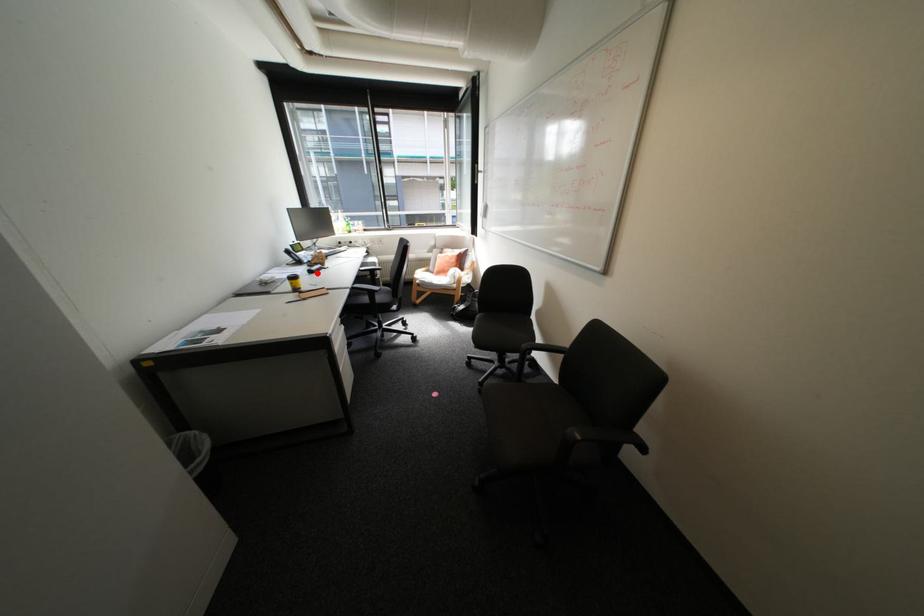
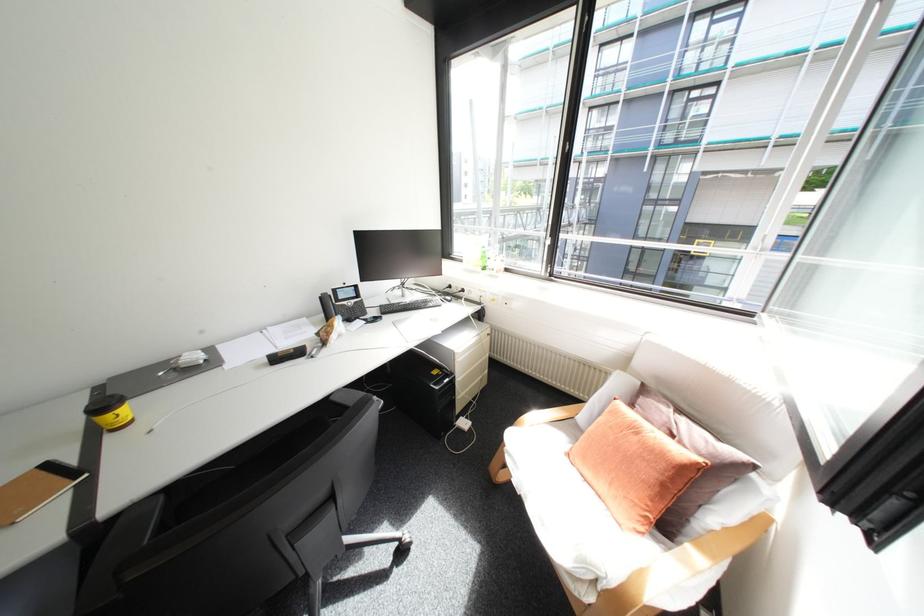
Find the pixel in the second image that matches the highlighted location in the first image.

(275, 361)